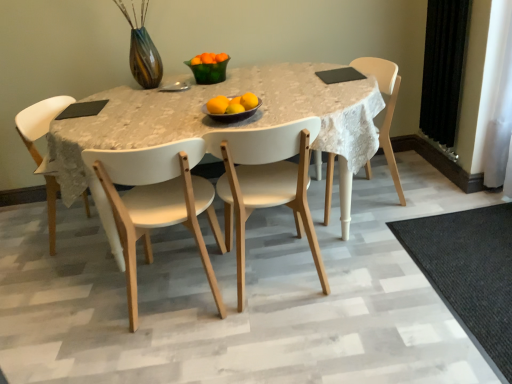
Question: Does point (162, 190) appear closer or farther from the camera than point (233, 109)?

Choices:
 (A) closer
 (B) farther

Answer: (B)

Question: Is white matte chair at center, the second chair in the left-to-right sequence, bigger or smaller than yellow matte/orange at center, which appears as the fifth orange when viewed from the back?

Choices:
 (A) small
 (B) big

Answer: (B)

Question: Which object is the farthest from the white wood chair at center, which is the 4th chair from left to right?

Choices:
 (A) yellow matte/orange at center, the sixth orange viewed from the back
 (B) yellow matte/orange at center, the third orange from the back
 (C) orange matte at center, which is the fifth orange from front to back
 (D) orange matte at center, which is the sixth orange in bottom-to-top order
 (E) yellow matte/orange at center, which is the third orange from front to back

Answer: (A)

Question: Which object is the farthest from the black velvet curtain at right?

Choices:
 (A) yellow matte/orange at center, the third orange from the back
 (B) orange matte at center, the 2th orange viewed from the top
 (C) orange matte at center, marked as the first orange in a top-to-bottom arrangement
 (D) yellow matte/orange at center, acting as the 2th orange starting from the front
 (E) white matte chair at center, which appears as the first chair when viewed from the left

Answer: (E)